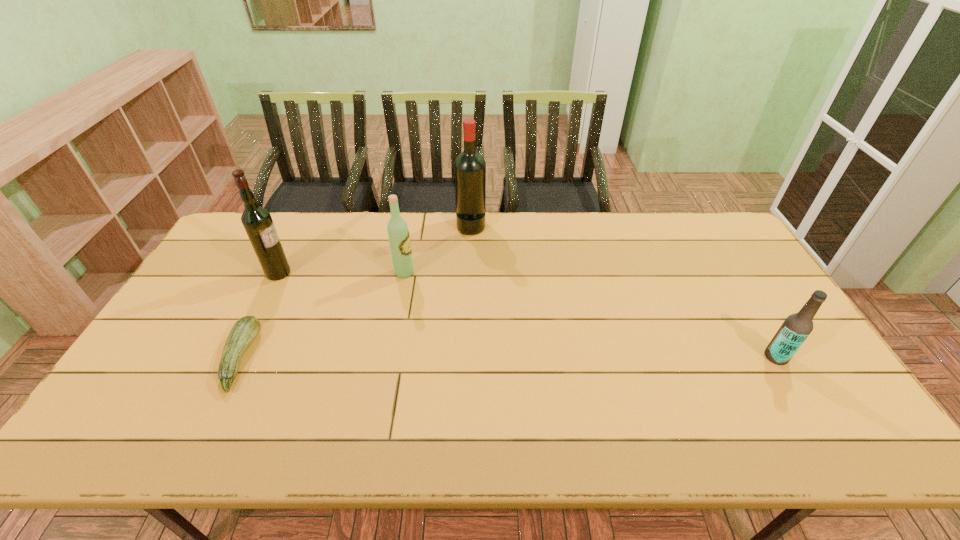
In the image, there is a desktop. Where is `free space at the right edge`? free space at the right edge is located at coordinates (758, 291).

Identify the location of vacant space at the far right corner. This screenshot has width=960, height=540. (703, 228).

Identify the location of free space between the fourth tallest object and the shortest object. (508, 357).

Where is `vacant space that is in between the second wine bottle from left to right and the zucchini`? The width and height of the screenshot is (960, 540). vacant space that is in between the second wine bottle from left to right and the zucchini is located at coordinates (323, 315).

Locate an element on the screen. vacant space that is in between the leftmost wine bottle and the rightmost wine bottle is located at coordinates (374, 249).

Where is `free space that is in between the leftmost wine bottle and the second object from right to left`? This screenshot has height=540, width=960. free space that is in between the leftmost wine bottle and the second object from right to left is located at coordinates (374, 249).

What are the coordinates of `empty space between the beer bottle and the zucchini` in the screenshot? It's located at (508, 357).

The image size is (960, 540). What are the coordinates of `free space between the leftmost wine bottle and the farthest wine bottle` in the screenshot? It's located at (374, 249).

What are the coordinates of `empty space that is in between the third object from right to left and the fourth tallest object` in the screenshot? It's located at (590, 315).

Locate an element on the screen. vacant region between the zucchini and the third object from right to left is located at coordinates (323, 315).